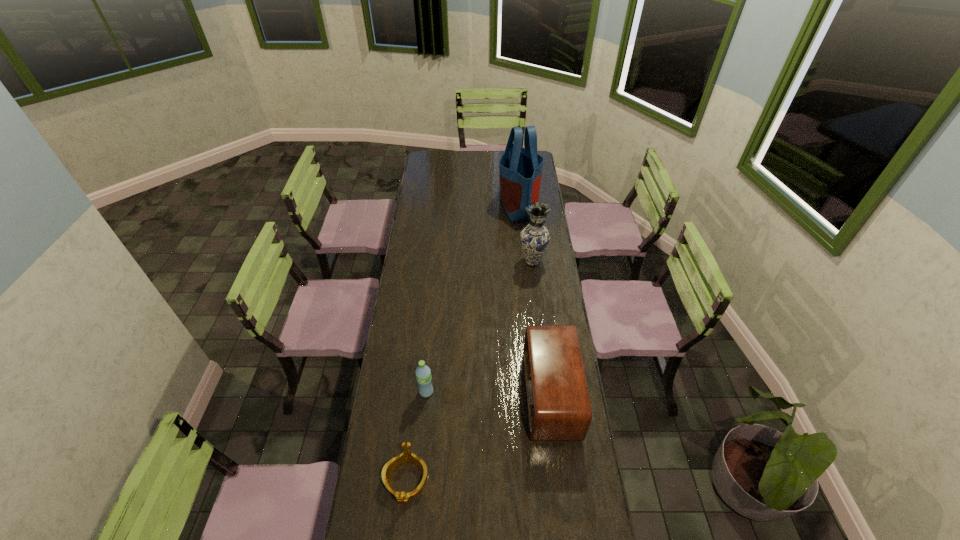
This screenshot has height=540, width=960. I want to click on free point between the radio receiver and the water bottle, so click(489, 393).

Identify which object is located as the third nearest to the tiara. Please provide its 2D coordinates. Your answer should be formatted as a tuple, i.e. [(x, y)], where the tuple contains the x and y coordinates of a point satisfying the conditions above.

[(535, 238)]

Locate an element on the screen. object that is the second closest one to the radio receiver is located at coordinates pyautogui.click(x=423, y=373).